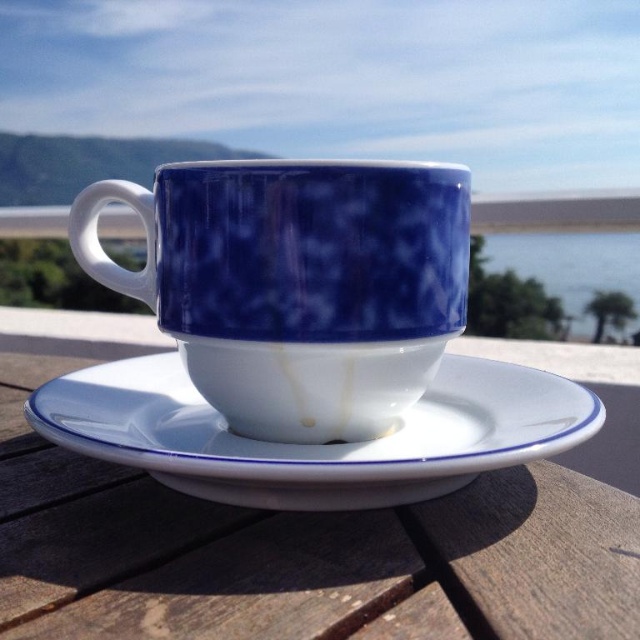
You are at a scenic outdoor table. You see a ceramic cup and saucer on the white wood table at center. Where is the point at coordinates (x=292, y=548) located?

The point at coordinates (x=292, y=548) is on the white wood table at center.

You are setting up a tea set for a guest and have a blue glossy mug at center and a white glossy saucer at center. Which object should you place the tea leaves into before pouring hot water?

The blue glossy mug at center is smaller than the white glossy saucer at center, so you should place the tea leaves into the blue glossy mug at center before pouring hot water.

You are setting up a tea service and need to ensure that the blue glossy mug at center fits on the white glossy saucer at center. Based on the scene, can you determine if the mug will fit on the saucer?

The blue glossy mug at center has a width less than the white glossy saucer at center, so the mug will fit on the saucer.